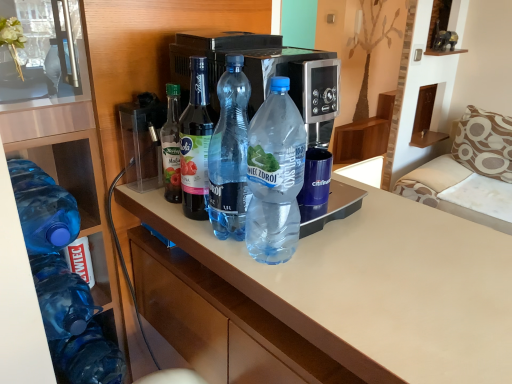
Image resolution: width=512 pixels, height=384 pixels. In order to click on vacant region to the left of transparent plastic bottle at center, which is the 3th bottle from left to right in this screenshot , I will do `click(155, 211)`.